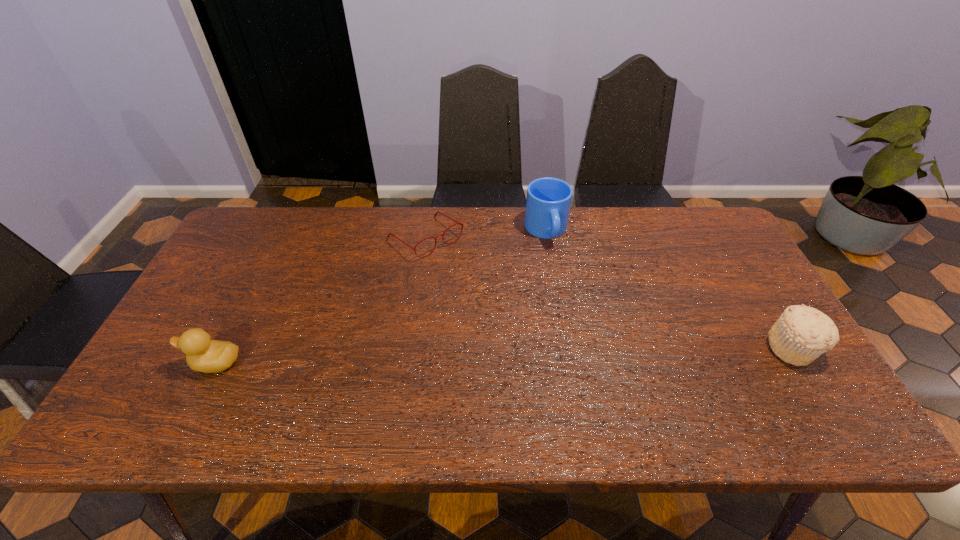
Locate an element on the screen. vacant space on the desktop that is between the leftmost object and the rightmost object and is positioned on the face of the third object from right to left is located at coordinates (561, 354).

You are a GUI agent. You are given a task and a screenshot of the screen. Output one action in this format:
    pyautogui.click(x=<x>, y=<y>)
    Task: Click on the free space on the desktop that is between the leftmost object and the muffin and is positioned on the side of the third object from left to right with the handle
    
    Given the screenshot: What is the action you would take?
    pyautogui.click(x=592, y=353)